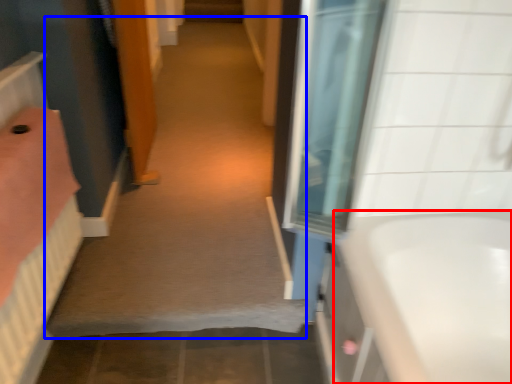
Question: Which object is further to the camera taking this photo, bathtub (highlighted by a red box) or plain (highlighted by a blue box)?

Choices:
 (A) bathtub
 (B) plain

Answer: (B)